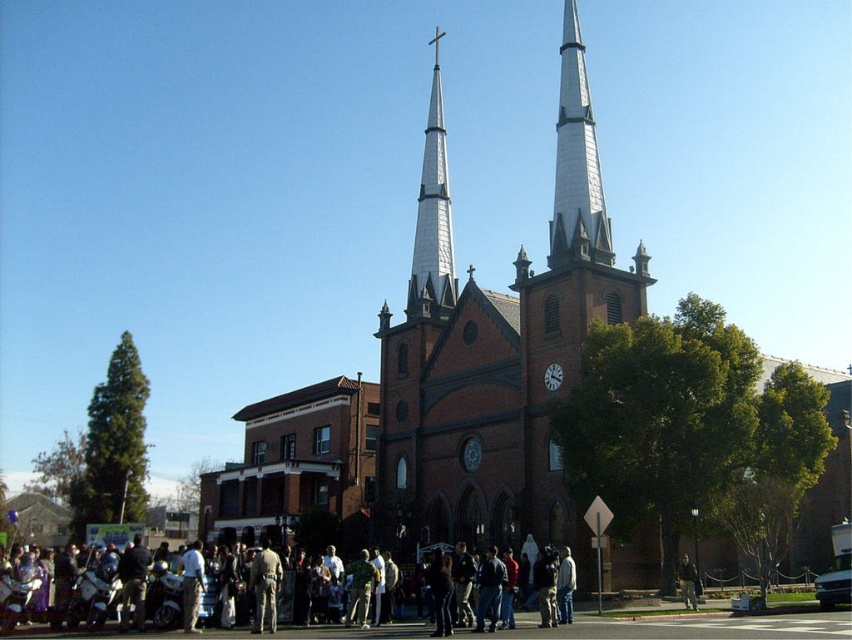
You are standing in front of the church and want to walk from point A to point B. Point A is located at coordinate point [430,124] and point B is at coordinate point [240,628]. Which point is closer to you when you are facing the church?

Point A at coordinate point [430,124] is closer to you because it is further to the viewer than point B at coordinate point [240,628].

You are standing in a park and see the brown brick church at center and the dark clothing at center. Which object is closer to you?

The brown brick church at center is closer to you than the dark clothing at center.

You are standing in front of the church and want to locate the point at coordinates point (435, 420). Based on the scene description, where exactly on the church would this point be located?

The point (435, 420) is on the brown brick church at center, so it would be located on the central part of the church facade made of brown bricks.